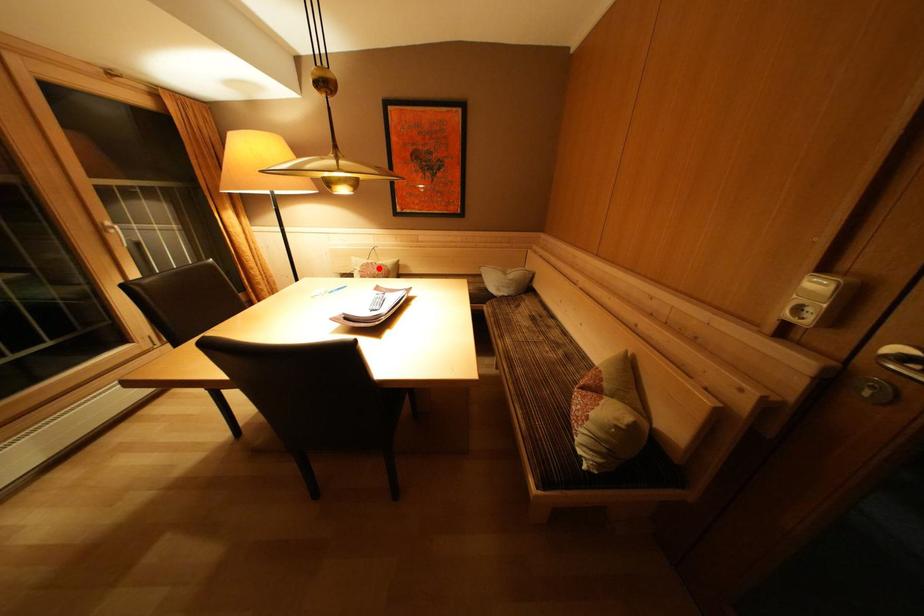
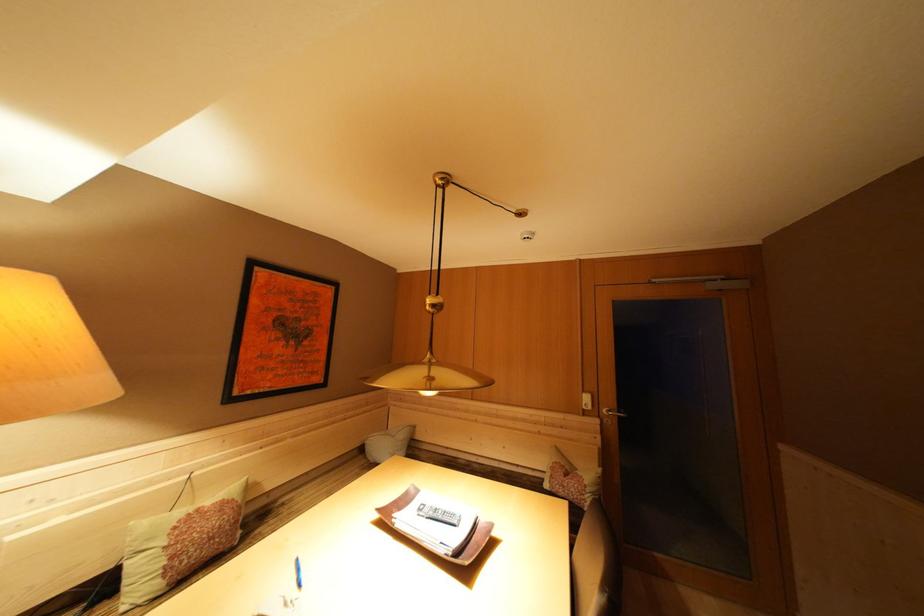
Question: A red point is marked in image1. In image2, is the corresponding 3D point closer to the camera or farther? Reply with the corresponding letter.

Choices:
 (A) The corresponding 3D point is closer.
 (B) The corresponding 3D point is farther.

Answer: (B)